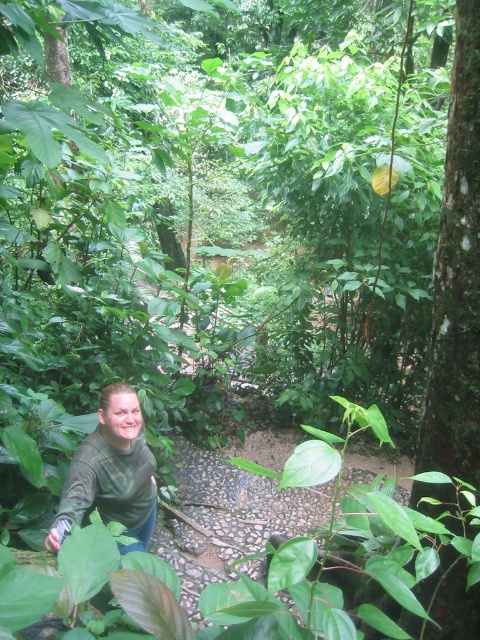
You are a hiker who wants to take a photo of the green rough bark tree at right and the green matte shirt at lower left. Which object should you focus on first if you want to capture both in a single frame without moving your camera?

You should focus on the green rough bark tree at right first because it is thinner than the green matte shirt at lower left, allowing it to fit within the frame more easily while still including the larger object.

You are a hiker trying to take a photo of the green rough bark tree at right and the green matte shirt at lower left. Which object should you focus on first if you want both to be in focus?

The green rough bark tree at right is taller than the green matte shirt at lower left, so you should focus on the green rough bark tree at right first to ensure both are in focus.

You are standing at the point labeled point (436, 394) and want to walk to the point labeled point (134, 486) along the narrow, winding path. Which direction should you face to move towards the destination?

You should face downward because point (436, 394) is closer to the camera than point (134, 486), so moving towards the destination requires facing away from the camera direction.